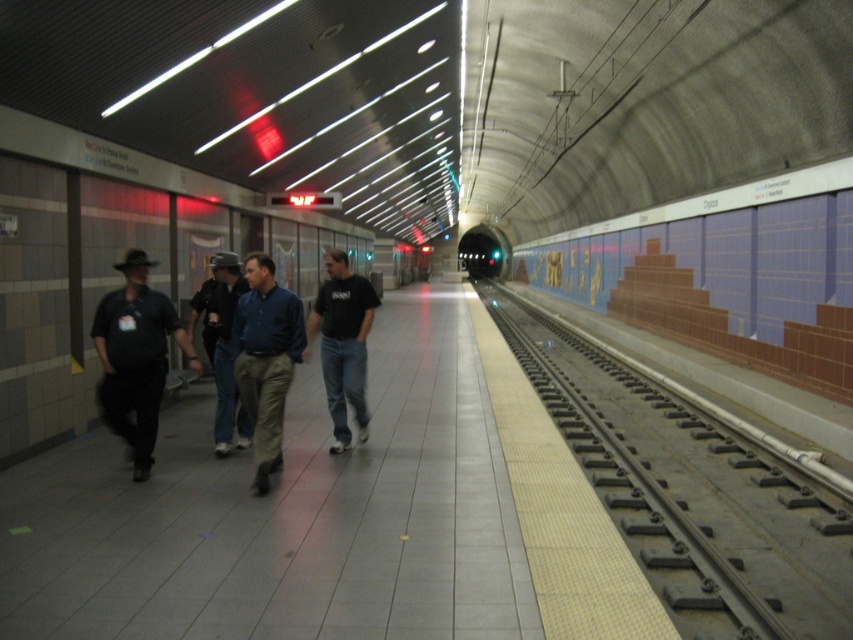
Question: Which point is farther from the camera taking this photo?

Choices:
 (A) (705, 586)
 (B) (352, 280)

Answer: (B)

Question: Which of the following is the farthest from the observer?

Choices:
 (A) matte black shirt at left
 (B) black metal track at right
 (C) blue shirt at center
 (D) black matte shirt at center

Answer: (D)

Question: Which point is farther from the camera taking this photo?

Choices:
 (A) (132, 458)
 (B) (219, 454)
 (C) (698, 445)

Answer: (C)

Question: Is matte black shirt at left to the left of blue shirt at center from the viewer's perspective?

Choices:
 (A) no
 (B) yes

Answer: (B)

Question: Is matte blue shirt at center positioned before blue shirt at center?

Choices:
 (A) no
 (B) yes

Answer: (B)

Question: Does matte blue shirt at center appear under blue shirt at center?

Choices:
 (A) no
 (B) yes

Answer: (B)